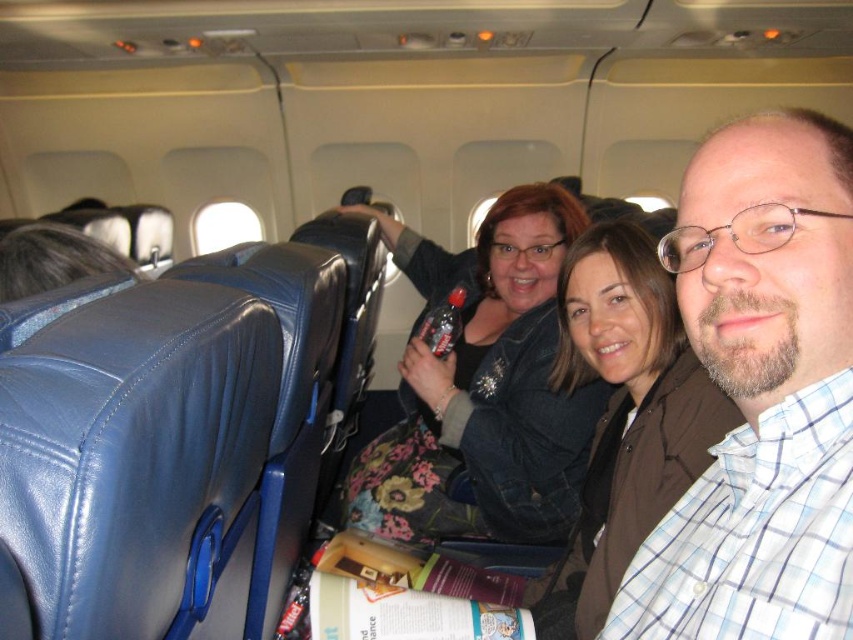
Question: Can you confirm if plaid shirt at center is positioned below brown leather jacket at center?

Choices:
 (A) no
 (B) yes

Answer: (A)

Question: Among these objects, which one is nearest to the camera?

Choices:
 (A) floral-patterned jacket at center
 (B) plaid shirt at center

Answer: (B)

Question: Is plaid shirt at center below brown leather jacket at center?

Choices:
 (A) yes
 (B) no

Answer: (B)

Question: Based on their relative distances, which object is farther from the brown leather jacket at center?

Choices:
 (A) plaid shirt at center
 (B) floral-patterned jacket at center

Answer: (B)

Question: Can you confirm if plaid shirt at center is positioned to the right of floral-patterned jacket at center?

Choices:
 (A) yes
 (B) no

Answer: (A)

Question: Which is farther from the brown leather jacket at center?

Choices:
 (A) floral-patterned jacket at center
 (B) plaid shirt at center

Answer: (A)